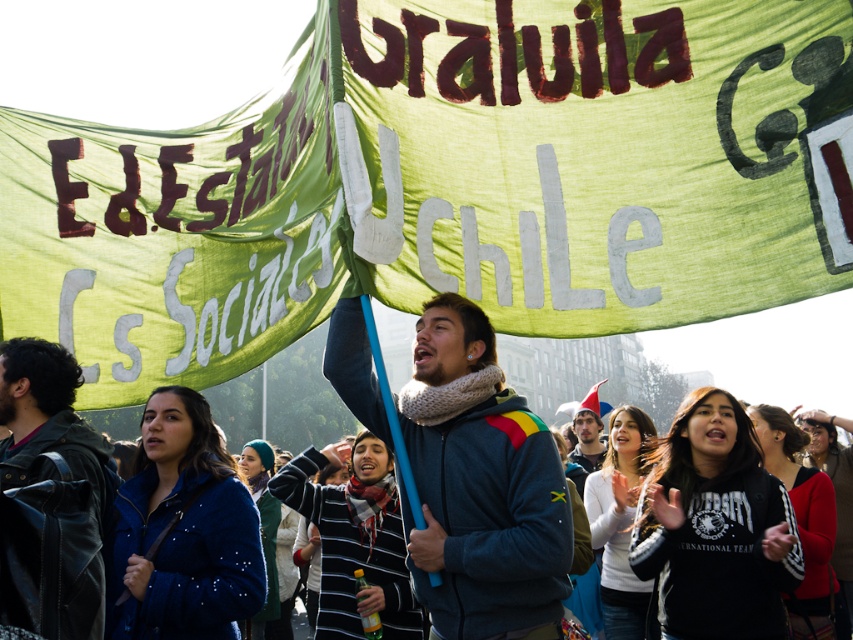
Question: Which object is farther from the camera taking this photo?

Choices:
 (A) dark blue sweater at center
 (B) dark brown leather jacket at lower left
 (C) green fabric banner at upper center
 (D) dark gray fleece jacket at center

Answer: (A)

Question: Among these points, which one is farthest from the camera?

Choices:
 (A) (578, 432)
 (B) (74, 493)
 (C) (538, 486)

Answer: (A)

Question: Is green fabric banner at upper center positioned before dark blue sweater at center?

Choices:
 (A) no
 (B) yes

Answer: (B)

Question: Can you confirm if green fabric banner at upper center is positioned to the left of dark gray fleece jacket at center?

Choices:
 (A) yes
 (B) no

Answer: (A)

Question: Based on their relative distances, which object is nearer to the dark blue sweater at center?

Choices:
 (A) dark gray fleece jacket at center
 (B) green fabric banner at upper center
 (C) dark brown leather jacket at lower left

Answer: (A)

Question: Is dark gray fleece jacket at center positioned behind dark blue sweater at center?

Choices:
 (A) no
 (B) yes

Answer: (A)